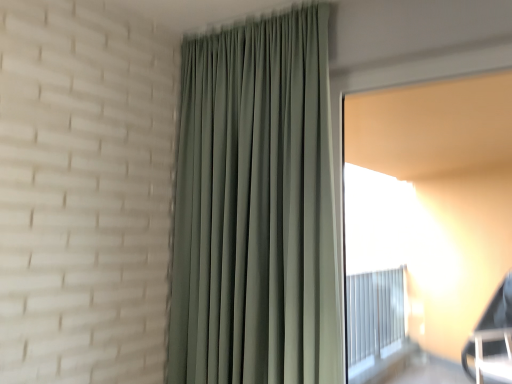
Question: In the image, is white matte window screen at right positioned in front of or behind sage green fabric curtain at center?

Choices:
 (A) behind
 (B) front

Answer: (B)

Question: From the image's perspective, is white matte window screen at right positioned above or below sage green fabric curtain at center?

Choices:
 (A) below
 (B) above

Answer: (A)

Question: Is point (370, 135) closer or farther from the camera than point (188, 198)?

Choices:
 (A) closer
 (B) farther

Answer: (B)

Question: From their relative heights in the image, would you say sage green fabric curtain at center is taller or shorter than white matte window screen at right?

Choices:
 (A) short
 (B) tall

Answer: (B)

Question: Is sage green fabric curtain at center wider or thinner than white matte window screen at right?

Choices:
 (A) thin
 (B) wide

Answer: (B)

Question: Considering the positions of point (298, 375) and point (502, 205), is point (298, 375) closer or farther from the camera than point (502, 205)?

Choices:
 (A) closer
 (B) farther

Answer: (B)

Question: In terms of size, does sage green fabric curtain at center appear bigger or smaller than white matte window screen at right?

Choices:
 (A) big
 (B) small

Answer: (A)